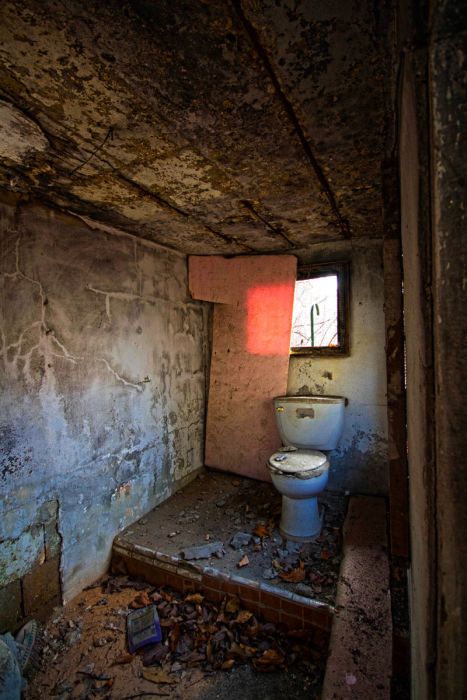
The height and width of the screenshot is (700, 467). I want to click on toilet seat/lid, so tap(300, 460).